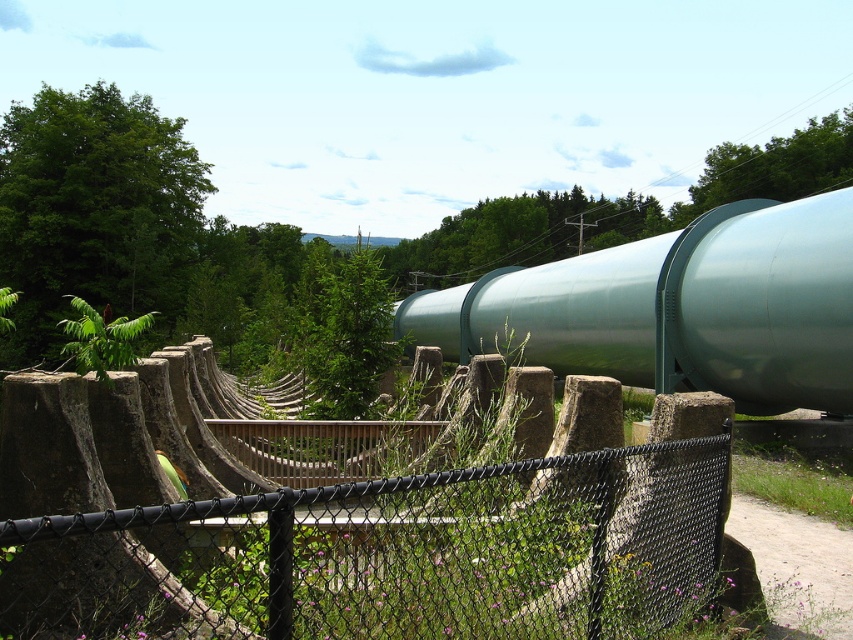
You are a maintenance worker who needs to reach the green metallic pipe at center and the green leafy tree at center. Which object is closer to the ground?

The green metallic pipe at center is shorter than the green leafy tree at center, so the green metallic pipe at center is closer to the ground.

You are standing at the center of the image and looking towards the fence. Which tree, the green leafy tree at upper left or the green leafy tree at upper right, is closer to you?

The green leafy tree at upper left is closer to you because it is in front of the green leafy tree at upper right.